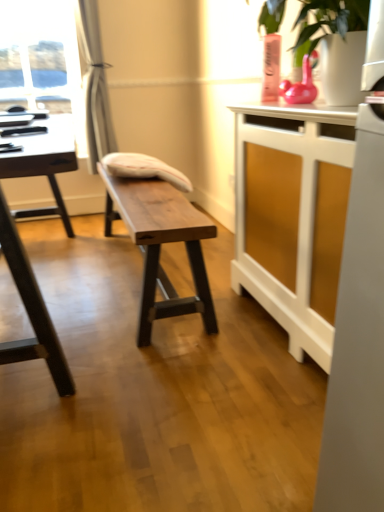
The image size is (384, 512). What do you see at coordinates (288, 215) in the screenshot? I see `white wood cabinet at right, the 3th table from the left` at bounding box center [288, 215].

What do you see at coordinates (144, 168) in the screenshot? The height and width of the screenshot is (512, 384). I see `white fabric cushion at center` at bounding box center [144, 168].

What is the approximate height of white fabric cushion at center?

The height of white fabric cushion at center is 16.84 centimeters.

Locate an element on the screen. The width and height of the screenshot is (384, 512). white wood cabinet at right, the 3th table from the left is located at coordinates (288, 215).

Consider the image. From a real-world perspective, which object stands above the other?

silky white curtain at left.

Is white fabric cushion at center next to silky white curtain at left?

white fabric cushion at center and silky white curtain at left are not in contact.

Between point (121, 170) and point (97, 144), which one is positioned behind?

The point (97, 144) is farther from the camera.

How many degrees apart are the facing directions of black glossy table at left, the 3th table from the right, and white wood cabinet at right, the 1th table positioned from the right?

2.34 degrees separate the facing orientations of black glossy table at left, the 3th table from the right, and white wood cabinet at right, the 1th table positioned from the right.

Does black glossy table at left, the 1th table from the left, turn towards white wood cabinet at right, the 3th table from the left?

No, black glossy table at left, the 1th table from the left, is not oriented towards white wood cabinet at right, the 3th table from the left.

Considering the positions of objects black glossy table at left, the 1th table from the left, and white wood cabinet at right, the 1th table positioned from the right, in the image provided, who is more to the right, black glossy table at left, the 1th table from the left, or white wood cabinet at right, the 1th table positioned from the right,?

white wood cabinet at right, the 1th table positioned from the right.

Can you confirm if white fabric cushion at center is shorter than natural wood bench at center, which is the 2th table in left-to-right order?

Yes, white fabric cushion at center is shorter than natural wood bench at center, which is the 2th table in left-to-right order.

Does point (142, 176) come closer to viewer compared to point (132, 232)?

That is False.

Could you tell me if white fabric cushion at center is turned towards natural wood bench at center, which is the 2th table in left-to-right order?

No, white fabric cushion at center is not facing towards natural wood bench at center, which is the 2th table in left-to-right order.

Is white fabric cushion at center not close to natural wood bench at center, the 2th table in the right-to-left sequence?

No, white fabric cushion at center is not far away from natural wood bench at center, the 2th table in the right-to-left sequence.

Is white wood cabinet at right, the 1th table positioned from the right, inside or outside of silky white curtain at left?

white wood cabinet at right, the 1th table positioned from the right, exists outside the volume of silky white curtain at left.

Considering the relative positions of white wood cabinet at right, the 1th table positioned from the right, and silky white curtain at left in the image provided, is white wood cabinet at right, the 1th table positioned from the right, behind silky white curtain at left?

No.

Where is `curtain that is on the left side of white wood cabinet at right, the 1th table positioned from the right`? curtain that is on the left side of white wood cabinet at right, the 1th table positioned from the right is located at coordinates (95, 86).

From the image's perspective, would you say white fabric cushion at center is shown under white wood cabinet at right, the 3th table from the left?

No, from the image's perspective, white fabric cushion at center is not beneath white wood cabinet at right, the 3th table from the left.

Is white fabric cushion at center in contact with white wood cabinet at right, the 3th table from the left?

white fabric cushion at center is not next to white wood cabinet at right, the 3th table from the left, and they're not touching.

Considering the sizes of objects white fabric cushion at center and white wood cabinet at right, the 3th table from the left, in the image provided, who is smaller, white fabric cushion at center or white wood cabinet at right, the 3th table from the left,?

white fabric cushion at center is smaller.

Can you confirm if white fabric cushion at center is wider than white wood cabinet at right, the 1th table positioned from the right?

Correct, the width of white fabric cushion at center exceeds that of white wood cabinet at right, the 1th table positioned from the right.

Considering the relative positions of white wood cabinet at right, the 3th table from the left, and black glossy table at left, the 1th table from the left, in the image provided, is white wood cabinet at right, the 3th table from the left, to the left of black glossy table at left, the 1th table from the left, from the viewer's perspective?

No.

From a real-world perspective, who is located higher, white wood cabinet at right, the 1th table positioned from the right, or black glossy table at left, the 3th table from the right?

In real-world perspective, white wood cabinet at right, the 1th table positioned from the right, is above.

From the image's perspective, is white wood cabinet at right, the 1th table positioned from the right, above black glossy table at left, the 1th table from the left?

No, from the image's perspective, white wood cabinet at right, the 1th table positioned from the right, is not above black glossy table at left, the 1th table from the left.

In the scene shown: Is white wood cabinet at right, the 1th table positioned from the right, not inside black glossy table at left, the 3th table from the right?

white wood cabinet at right, the 1th table positioned from the right, is positioned outside black glossy table at left, the 3th table from the right.

From a real-world perspective, is silky white curtain at left below white fabric cushion at center?

No, from a real-world perspective, silky white curtain at left is not below white fabric cushion at center.

Is point (90, 52) closer to camera compared to point (149, 159)?

No, (90, 52) is behind (149, 159).

In the image, is silky white curtain at left on the left side or the right side of white fabric cushion at center?

From the image, it's evident that silky white curtain at left is to the left of white fabric cushion at center.

I want to click on swivel chair in front of the silky white curtain at left, so click(x=144, y=168).

At what (x,y) coordinates should I click in order to perform the action: click on curtain above the white fabric cushion at center (from a real-world perspective). Please return your answer as a coordinate pair (x, y). Image resolution: width=384 pixels, height=512 pixels. Looking at the image, I should click on (95, 86).

Identify the location of the 2nd table to the left when counting from the white wood cabinet at right, the 1th table positioned from the right. (23, 247).

From the image, which object appears to be farther from white fabric cushion at center, natural wood bench at center, which is the 2th table in left-to-right order, or white wood cabinet at right, the 3th table from the left?

white wood cabinet at right, the 3th table from the left, lies further to white fabric cushion at center than the other object.

Based on the photo, looking at the image, which one is located closer to white wood cabinet at right, the 1th table positioned from the right, natural wood bench at center, which is the 2th table in left-to-right order, or white fabric cushion at center?

natural wood bench at center, which is the 2th table in left-to-right order, is positioned closer to the anchor white wood cabinet at right, the 1th table positioned from the right.

When comparing their distances from natural wood bench at center, which is the 2th table in left-to-right order, does silky white curtain at left or white fabric cushion at center seem closer?

Among the two, white fabric cushion at center is located nearer to natural wood bench at center, which is the 2th table in left-to-right order.

From the image, which object appears to be farther from natural wood bench at center, the 2th table in the right-to-left sequence, white fabric cushion at center or black glossy table at left, the 3th table from the right?

black glossy table at left, the 3th table from the right.

Estimate the real-world distances between objects in this image. Which object is closer to black glossy table at left, the 1th table from the left, natural wood bench at center, which is the 2th table in left-to-right order, or white wood cabinet at right, the 3th table from the left?

natural wood bench at center, which is the 2th table in left-to-right order, is closer to black glossy table at left, the 1th table from the left.

When comparing their distances from white fabric cushion at center, does black glossy table at left, the 3th table from the right, or white wood cabinet at right, the 1th table positioned from the right, seem closer?

Among the two, white wood cabinet at right, the 1th table positioned from the right, is located nearer to white fabric cushion at center.

When comparing their distances from silky white curtain at left, does white fabric cushion at center or white wood cabinet at right, the 1th table positioned from the right, seem further?

Based on the image, white wood cabinet at right, the 1th table positioned from the right, appears to be further to silky white curtain at left.

Considering their positions, is black glossy table at left, the 1th table from the left, positioned further to white wood cabinet at right, the 1th table positioned from the right, than natural wood bench at center, which is the 2th table in left-to-right order?

Based on the image, black glossy table at left, the 1th table from the left, appears to be further to white wood cabinet at right, the 1th table positioned from the right.

You are a GUI agent. You are given a task and a screenshot of the screen. Output one action in this format:
    pyautogui.click(x=<x>, y=<y>)
    Task: Click on the swivel chair between white wood cabinet at right, the 1th table positioned from the right, and silky white curtain at left, along the z-axis
    
    Given the screenshot: What is the action you would take?
    [144, 168]

Where is `swivel chair between natural wood bench at center, the 2th table in the right-to-left sequence, and silky white curtain at left, along the z-axis`? This screenshot has width=384, height=512. swivel chair between natural wood bench at center, the 2th table in the right-to-left sequence, and silky white curtain at left, along the z-axis is located at coordinates (144, 168).

I want to click on table situated between black glossy table at left, the 3th table from the right, and white wood cabinet at right, the 1th table positioned from the right, from left to right, so pos(160,244).

I want to click on table between white wood cabinet at right, the 1th table positioned from the right, and silky white curtain at left in the front-back direction, so click(x=160, y=244).